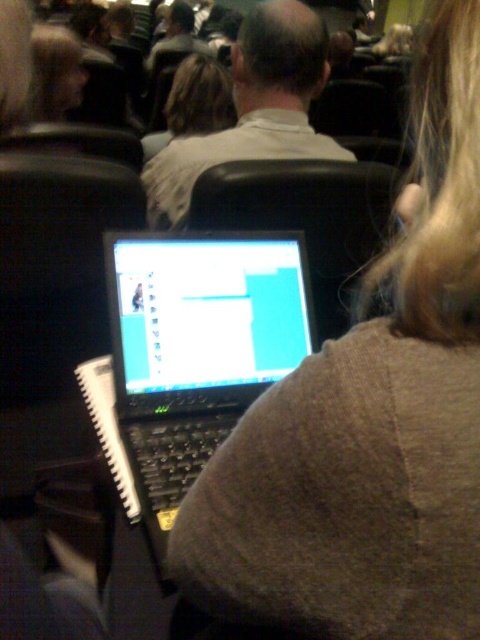
Question: Which of the following is the farthest from the observer?

Choices:
 (A) light beige shirt at center
 (B) matte black laptop at center
 (C) black plastic laptop at center
 (D) blonde hair at upper left

Answer: (D)

Question: Is black plastic laptop at center thinner than light beige shirt at center?

Choices:
 (A) no
 (B) yes

Answer: (B)

Question: Among these objects, which one is farthest from the camera?

Choices:
 (A) black plastic laptop at center
 (B) light beige shirt at center
 (C) blonde hair at upper left

Answer: (C)

Question: Where is matte black laptop at center located in relation to blonde hair at upper left in the image?

Choices:
 (A) left
 (B) right

Answer: (B)

Question: Is black plastic laptop at center positioned at the back of light beige shirt at center?

Choices:
 (A) no
 (B) yes

Answer: (A)

Question: Which point is farther from the camera taking this photo?

Choices:
 (A) (302, 141)
 (B) (235, 346)

Answer: (A)